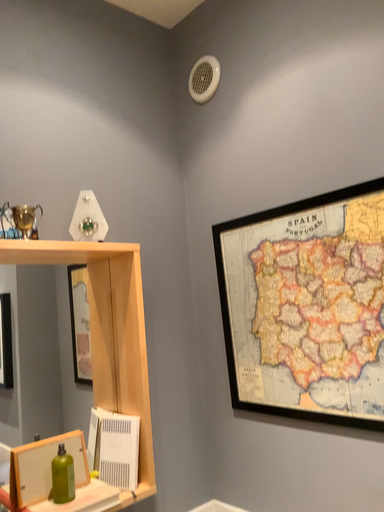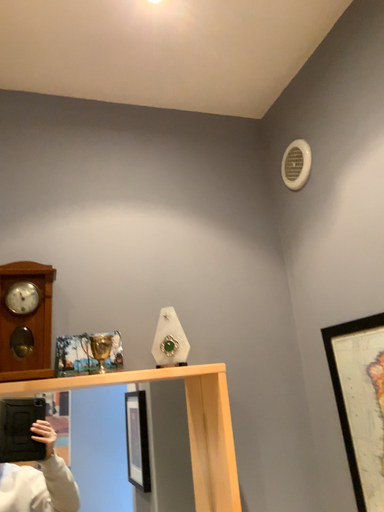
Question: How did the camera likely rotate when shooting the video?

Choices:
 (A) rotated right
 (B) rotated left

Answer: (B)